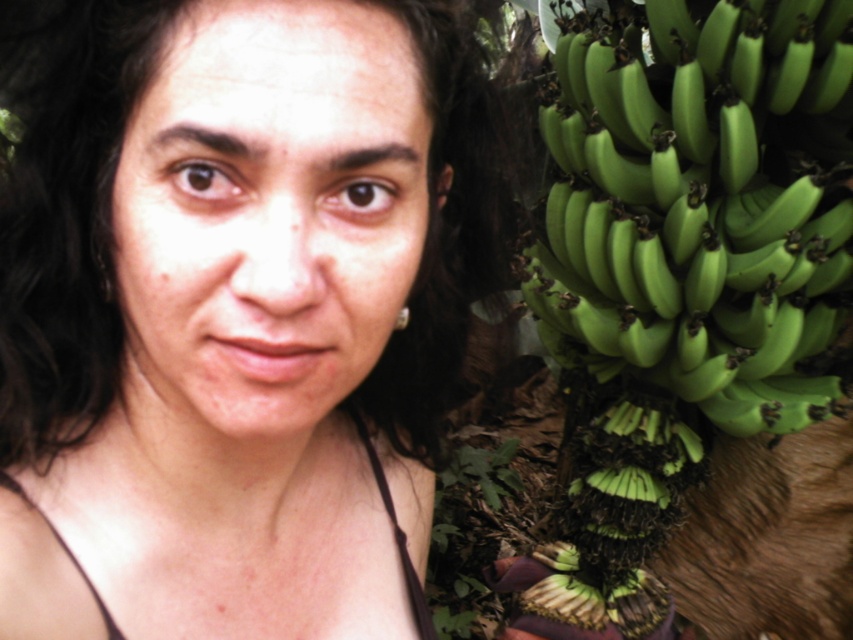
You are a photographer adjusting the focus of your camera. You want to capture the matte skin at center clearly while keeping the green matte bananas at right in the background. Can you achieve this with a shallow depth of field?

Yes, since the matte skin at center is positioned over the green matte bananas at right, using a shallow depth of field will keep the matte skin at center in focus and blur the background green matte bananas at right.

You are a photographer adjusting your camera settings to capture the scene. The matte skin at center and the green matte bananas at right are both in focus. Which object would require a smaller aperture setting to ensure sharpness due to its size?

The matte skin at center is smaller than the green matte bananas at right. Since smaller objects require a smaller aperture to maintain sharpness, the matte skin at center would need a smaller aperture setting.

You are a photographer adjusting lighting for a portrait. The subject has matte skin at center and there are green matte bananas at right in the frame. Which surface would reflect less light, requiring more fill light?

The matte skin at center reflects less light because it is thinner than the green matte bananas at right, so more fill light is needed there.